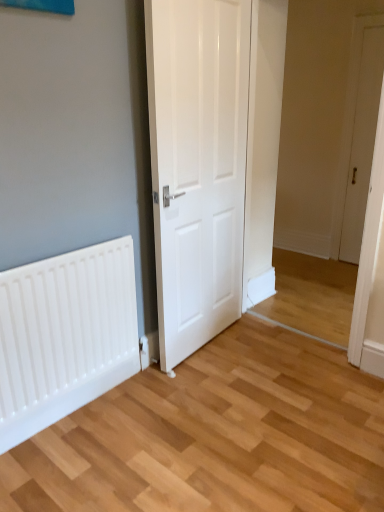
Identify the location of vacant space to the right of white glossy door at center, the 2th door in the back-to-front sequence. The height and width of the screenshot is (512, 384). (274, 351).